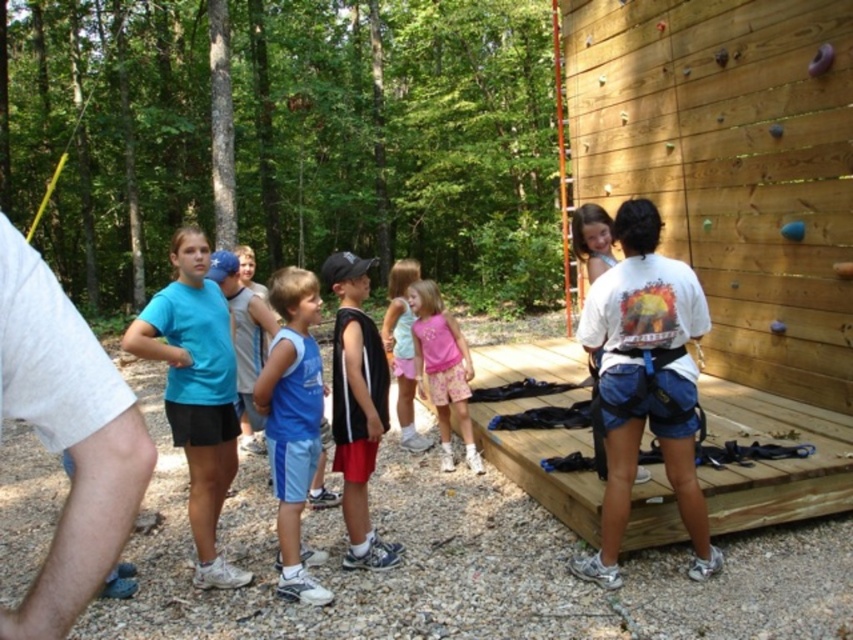
Looking at this image, based on the coordinates provided, which object is located at point (67, 435) in the image?

The point (67, 435) corresponds to the white cotton shirt at left.